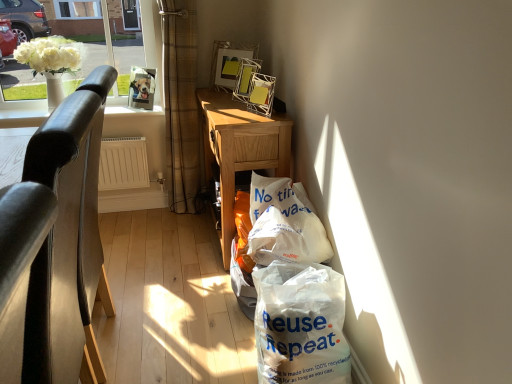
Question: Are metallic wire picture frame at upper center and wooden desk at center far apart?

Choices:
 (A) no
 (B) yes

Answer: (A)

Question: Does metallic wire picture frame at upper center have a greater height compared to wooden desk at center?

Choices:
 (A) yes
 (B) no

Answer: (B)

Question: Can you confirm if metallic wire picture frame at upper center is thinner than wooden desk at center?

Choices:
 (A) yes
 (B) no

Answer: (A)

Question: Is metallic wire picture frame at upper center at the left side of wooden desk at center?

Choices:
 (A) yes
 (B) no

Answer: (A)

Question: Considering the relative positions of metallic wire picture frame at upper center and wooden desk at center in the image provided, is metallic wire picture frame at upper center to the right of wooden desk at center from the viewer's perspective?

Choices:
 (A) yes
 (B) no

Answer: (B)

Question: Considering the positions of brown plaid curtain at upper left and wooden desk at center in the image, is brown plaid curtain at upper left wider or thinner than wooden desk at center?

Choices:
 (A) thin
 (B) wide

Answer: (A)

Question: Would you say brown plaid curtain at upper left is to the left or to the right of wooden desk at center in the picture?

Choices:
 (A) left
 (B) right

Answer: (A)

Question: From the image's perspective, relative to wooden desk at center, is brown plaid curtain at upper left above or below?

Choices:
 (A) above
 (B) below

Answer: (A)

Question: From a real-world perspective, is brown plaid curtain at upper left positioned above or below wooden desk at center?

Choices:
 (A) above
 (B) below

Answer: (A)

Question: Is white glass vase at upper left in front of or behind brown plaid curtain at upper left in the image?

Choices:
 (A) behind
 (B) front

Answer: (A)

Question: Does point (117, 49) appear closer or farther from the camera than point (189, 192)?

Choices:
 (A) farther
 (B) closer

Answer: (B)

Question: Considering the relative positions of white glass vase at upper left and brown plaid curtain at upper left in the image provided, is white glass vase at upper left to the left or to the right of brown plaid curtain at upper left?

Choices:
 (A) right
 (B) left

Answer: (B)

Question: In terms of size, does white glass vase at upper left appear bigger or smaller than brown plaid curtain at upper left?

Choices:
 (A) big
 (B) small

Answer: (B)

Question: From a real-world perspective, is black leather chair at left physically located above or below wooden desk at center?

Choices:
 (A) above
 (B) below

Answer: (A)

Question: Is black leather chair at left wider or thinner than wooden desk at center?

Choices:
 (A) wide
 (B) thin

Answer: (A)